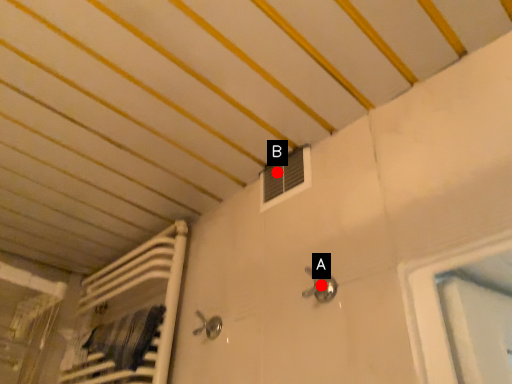
Question: Two points are circled on the image, labeled by A and B beside each circle. Which point appears farthest from the camera in this image?

Choices:
 (A) A is further
 (B) B is further

Answer: (B)